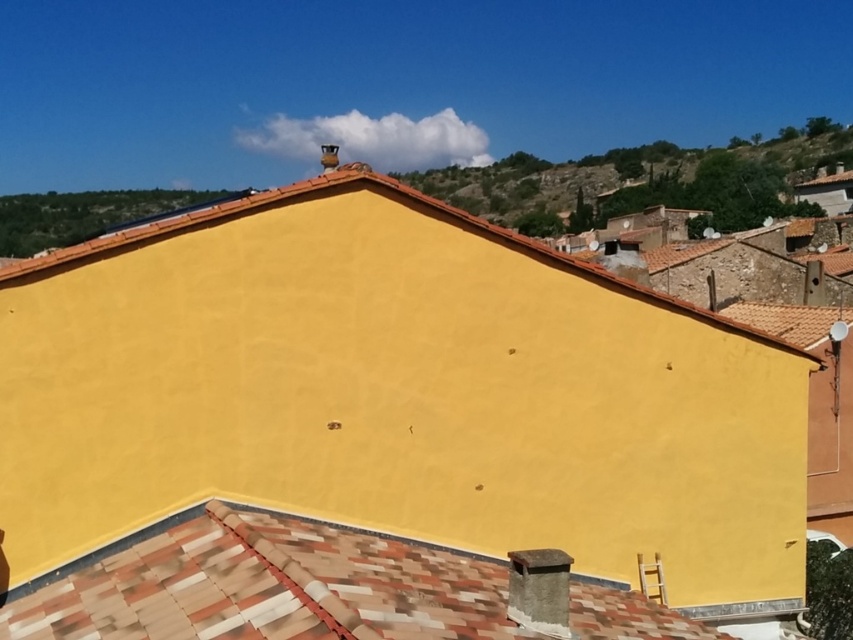
Question: Can you confirm if terracotta tiles at center is wider than matte yellow wall at upper center?

Choices:
 (A) yes
 (B) no

Answer: (B)

Question: Is terracotta tiles at center to the right of matte yellow wall at upper center from the viewer's perspective?

Choices:
 (A) no
 (B) yes

Answer: (A)

Question: Which point is closer to the camera?

Choices:
 (A) terracotta tiles at center
 (B) matte yellow wall at upper center

Answer: (A)

Question: Among these objects, which one is farthest from the camera?

Choices:
 (A) terracotta tiles at center
 (B) matte yellow wall at upper center

Answer: (B)

Question: Can you confirm if terracotta tiles at center is positioned above matte yellow wall at upper center?

Choices:
 (A) no
 (B) yes

Answer: (A)

Question: Among these objects, which one is farthest from the camera?

Choices:
 (A) matte yellow wall at upper center
 (B) matte yellow wall at center

Answer: (B)